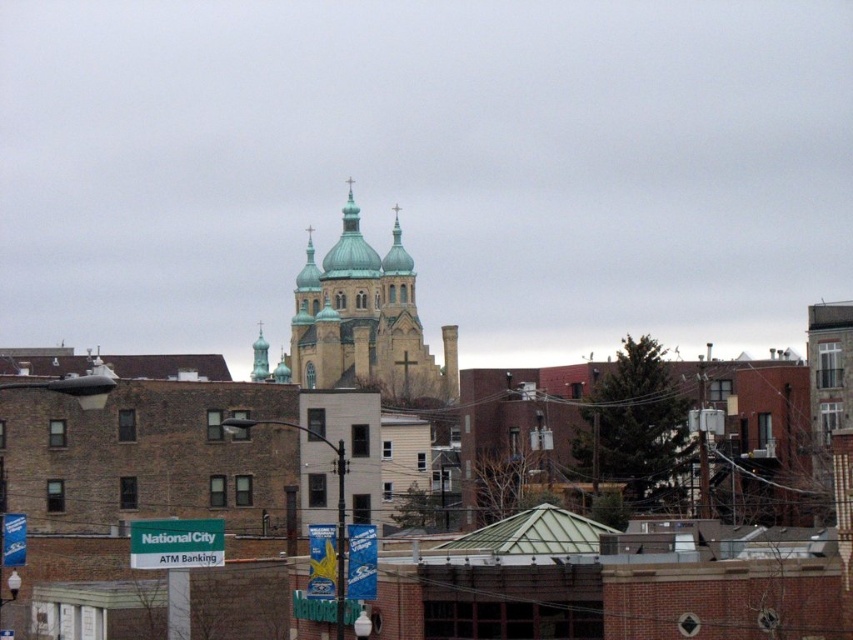
Question: Observing the image, what is the correct spatial positioning of green glazed dome at center in reference to green plastic sign at lower left?

Choices:
 (A) left
 (B) right

Answer: (B)

Question: Is stone church at center to the left of green glazed dome at center from the viewer's perspective?

Choices:
 (A) no
 (B) yes

Answer: (A)

Question: Is green glazed dome at center behind green plastic sign at lower left?

Choices:
 (A) yes
 (B) no

Answer: (A)

Question: Which point is closer to the camera taking this photo?

Choices:
 (A) (762, 552)
 (B) (401, 289)

Answer: (A)

Question: Which point is farther to the camera?

Choices:
 (A) (393, 216)
 (B) (573, 604)

Answer: (A)

Question: Which object is positioned closest to the stone church at center?

Choices:
 (A) green plastic sign at lower left
 (B) green glazed dome at center

Answer: (B)